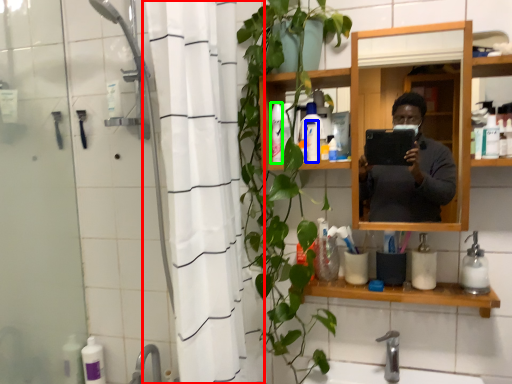
Question: Which object is the farthest from shower curtain (highlighted by a red box)? Choose among these: toiletry (highlighted by a blue box) or toiletry (highlighted by a green box).

Choices:
 (A) toiletry
 (B) toiletry

Answer: (A)